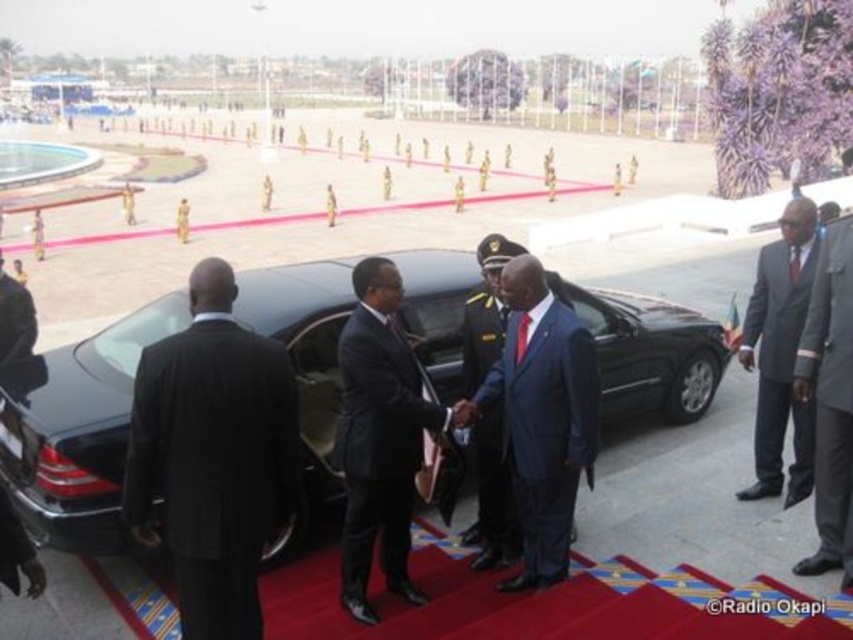
Is blue glossy suit at center further to camera compared to dark blue suit at center?

Yes, blue glossy suit at center is behind dark blue suit at center.

Is blue glossy suit at center thinner than dark blue suit at center?

Yes, blue glossy suit at center is thinner than dark blue suit at center.

What do you see at coordinates (543, 417) in the screenshot?
I see `blue glossy suit at center` at bounding box center [543, 417].

Find the location of a particular element. The height and width of the screenshot is (640, 853). blue glossy suit at center is located at coordinates (543, 417).

Which is above, blue glossy suit at center or dark blue satin suit at center?

blue glossy suit at center is above.

Can you confirm if blue glossy suit at center is bigger than dark blue satin suit at center?

Yes.

Where is `blue glossy suit at center`? This screenshot has width=853, height=640. blue glossy suit at center is located at coordinates (543, 417).

Between black suit at center and gray woolen suit at right, which one appears on the left side from the viewer's perspective?

black suit at center is more to the left.

Based on the photo, does black suit at center have a lesser width compared to gray woolen suit at right?

In fact, black suit at center might be wider than gray woolen suit at right.

Who is more distant from viewer, [267,532] or [828,392]?

The point [828,392] is more distant.

Where is `black suit at center`? The image size is (853, 640). black suit at center is located at coordinates (212, 456).